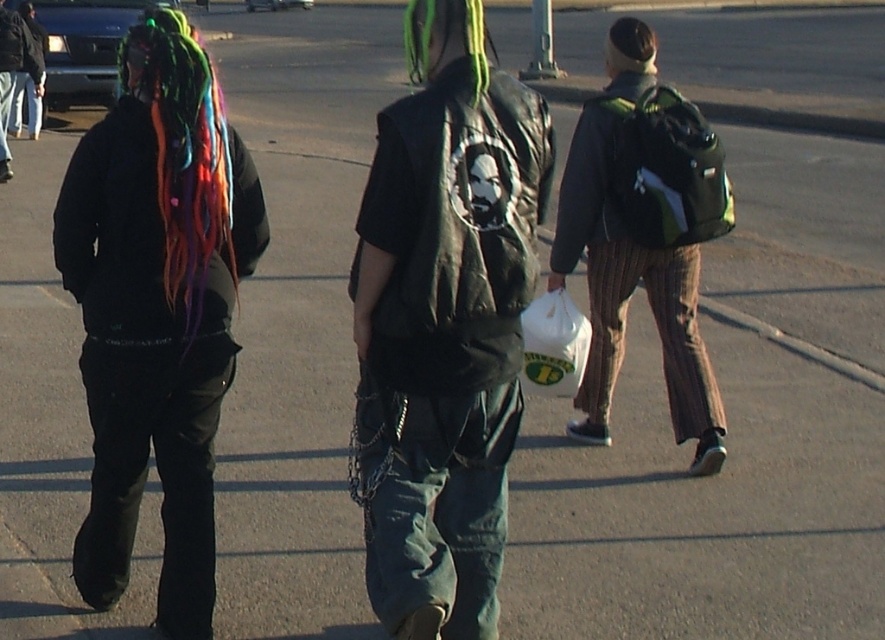
You are a photographer trying to capture the black matte jacket at left and the white plastic bag at center in your shot. Based on their sizes, which object should you focus on first if you want to ensure both are clearly visible in the frame?

The black matte jacket at left is larger than the white plastic bag at center, so you should focus on the black matte jacket at left first to ensure both are clearly visible in the frame.

You are standing in the parking lot and see two points marked on the ground. The first point is at coordinates point (395, 198) and the second point is at coordinates point (204, 372). Which point is closer to you?

Point (395, 198) is closer to the viewer than point (204, 372).